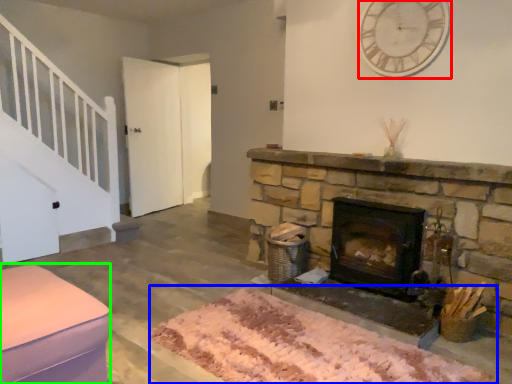
Question: Estimate the real-world distances between objects in this image. Which object is closer to clock (highlighted by a red box), mat (highlighted by a blue box) or furniture (highlighted by a green box)?

Choices:
 (A) mat
 (B) furniture

Answer: (A)